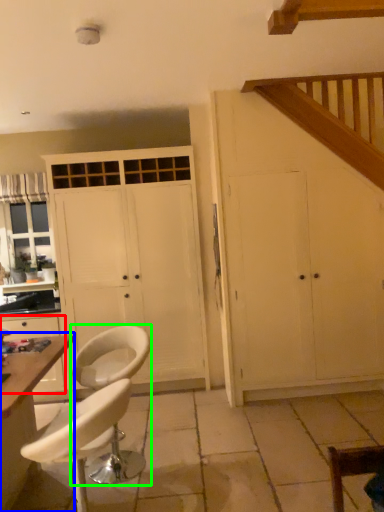
Question: Which object is the closest to the cabinetry (highlighted by a red box)? Choose among these: table (highlighted by a blue box) or chair (highlighted by a green box).

Choices:
 (A) table
 (B) chair

Answer: (B)